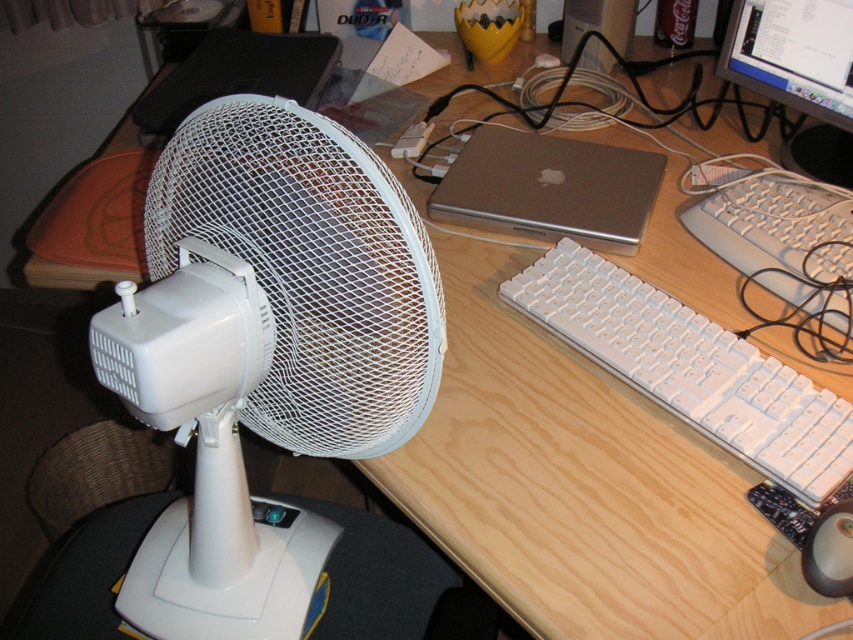
Question: Which point appears closest to the camera in this image?

Choices:
 (A) (820, 490)
 (B) (717, 225)
 (C) (846, 80)
 (D) (154, 92)

Answer: (A)

Question: Can you confirm if white plastic fan at left is wider than white plastic keyboard at center-right?

Choices:
 (A) no
 (B) yes

Answer: (B)

Question: Can you confirm if satin silver laptop at center is bigger than satin silver laptop at upper center?

Choices:
 (A) no
 (B) yes

Answer: (A)

Question: Estimate the real-world distances between objects in this image. Which object is farther from the white plastic keyboard at right?

Choices:
 (A) satin silver laptop at center
 (B) white plastic keyboard at center-right

Answer: (B)

Question: Can you confirm if white plastic keyboard at center-right is positioned below matte plastic monitor at upper right?

Choices:
 (A) yes
 (B) no

Answer: (A)

Question: Estimate the real-world distances between objects in this image. Which object is farther from the matte plastic monitor at upper right?

Choices:
 (A) white plastic keyboard at right
 (B) satin silver laptop at upper center

Answer: (B)